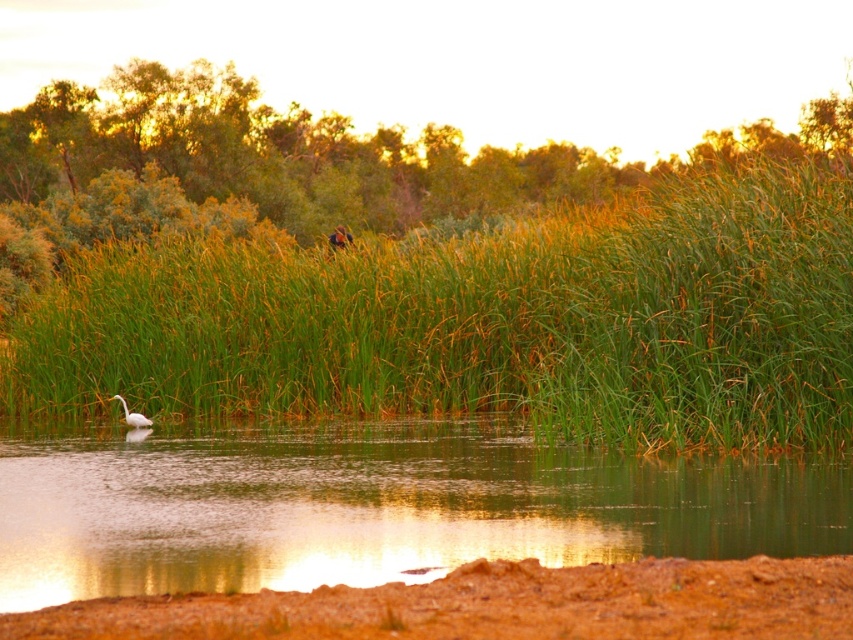
Question: Which is farther from the green grass at center?

Choices:
 (A) white matte bird at lower left
 (B) clear water at center

Answer: (A)

Question: Which of the following is the closest to the observer?

Choices:
 (A) clear water at center
 (B) white matte bird at lower left

Answer: (A)

Question: Does green grass at center have a smaller size compared to clear water at center?

Choices:
 (A) yes
 (B) no

Answer: (B)

Question: In this image, where is clear water at center located relative to white matte bird at lower left?

Choices:
 (A) below
 (B) above

Answer: (A)

Question: In this image, where is green grass at center located relative to clear water at center?

Choices:
 (A) below
 (B) above

Answer: (B)

Question: Which object appears farthest from the camera in this image?

Choices:
 (A) white matte bird at lower left
 (B) green grass at center

Answer: (A)